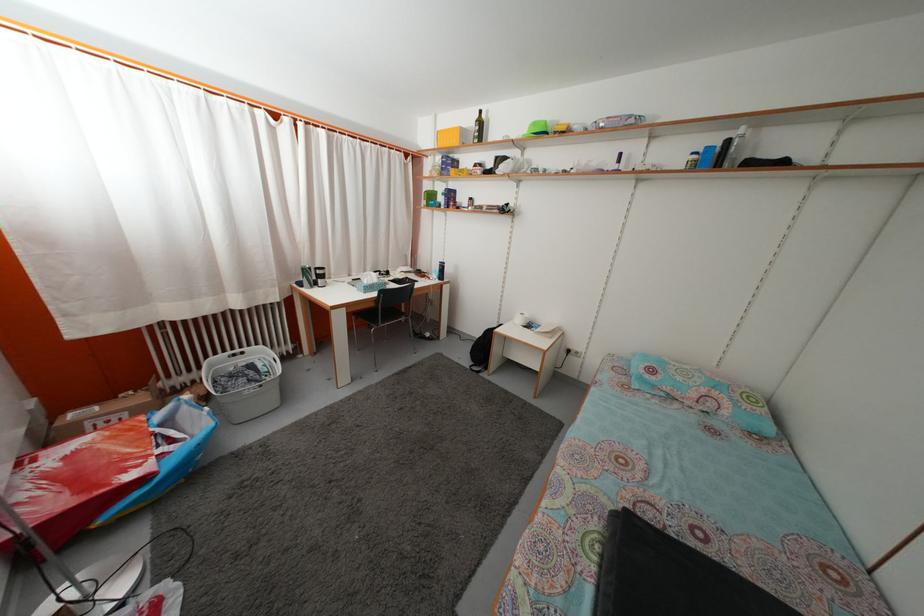
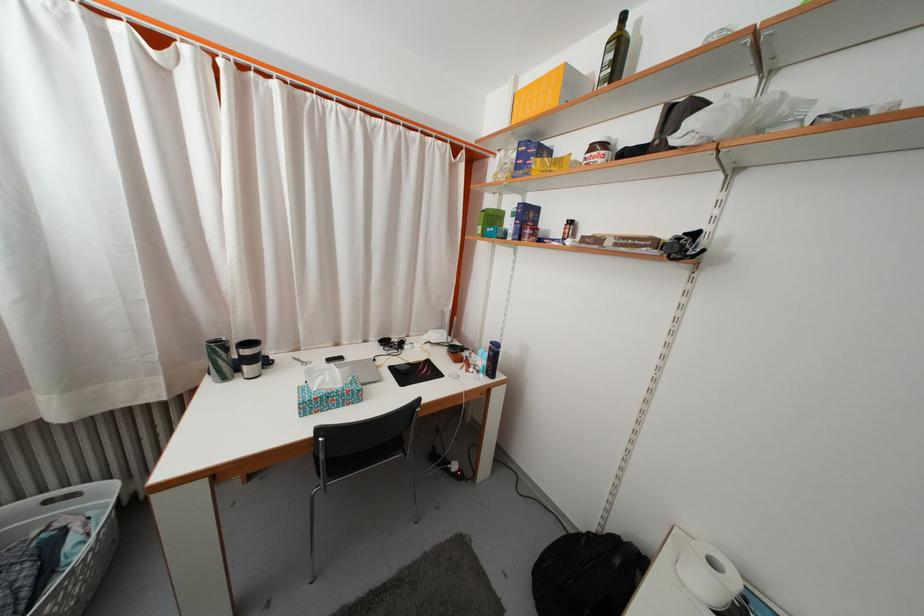
In the second image, find the point that corresponds to pixel 440 277 in the first image.

(485, 359)